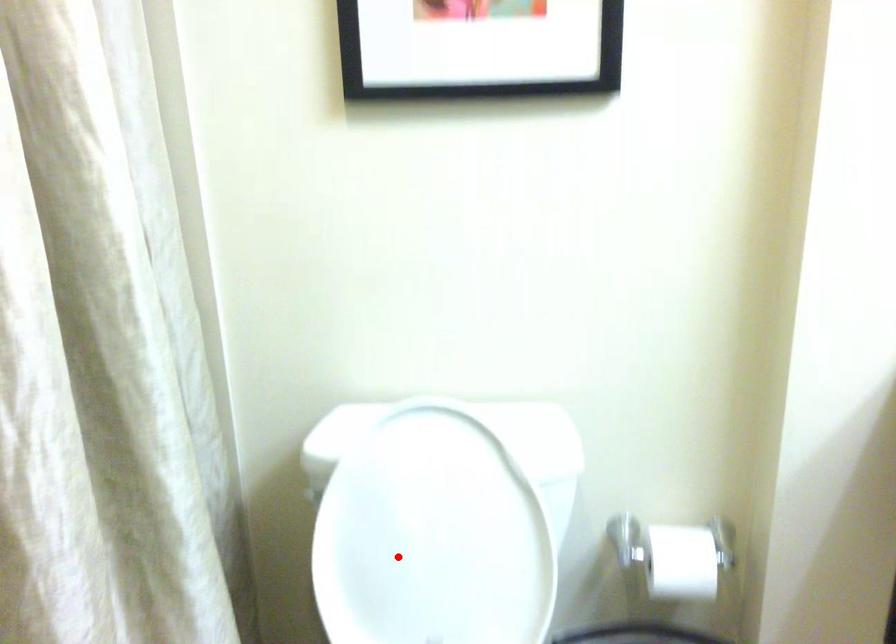
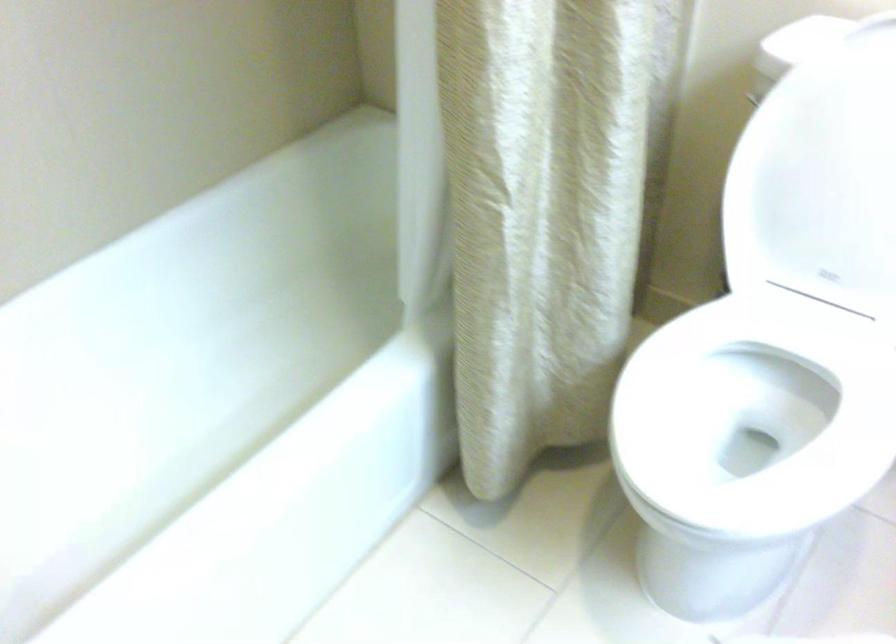
Question: I am providing you with two images of the same scene from different viewpoints. A red point is marked on the first image. At the location where the point appears in image 1, is it still visible in image 2?

Choices:
 (A) Yes
 (B) No

Answer: (A)